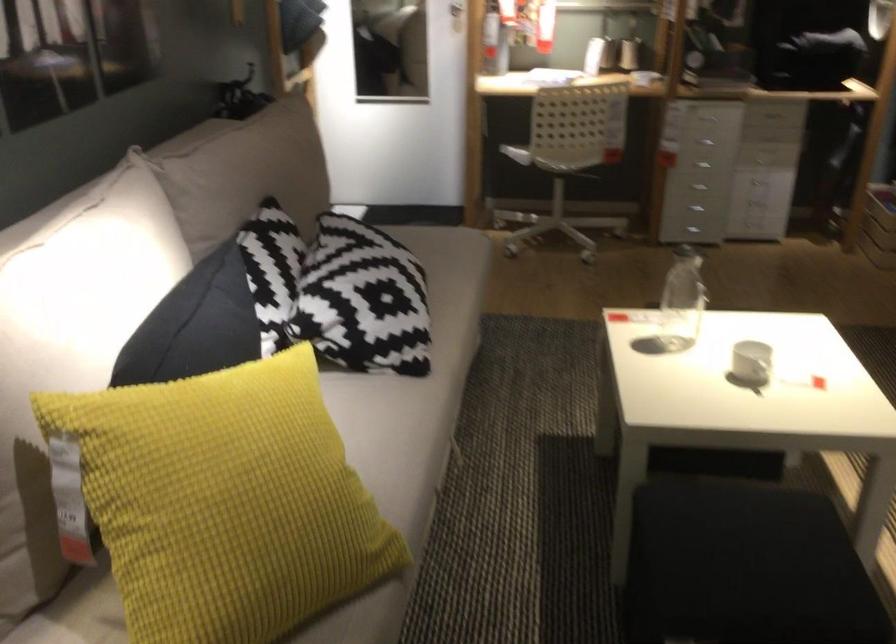
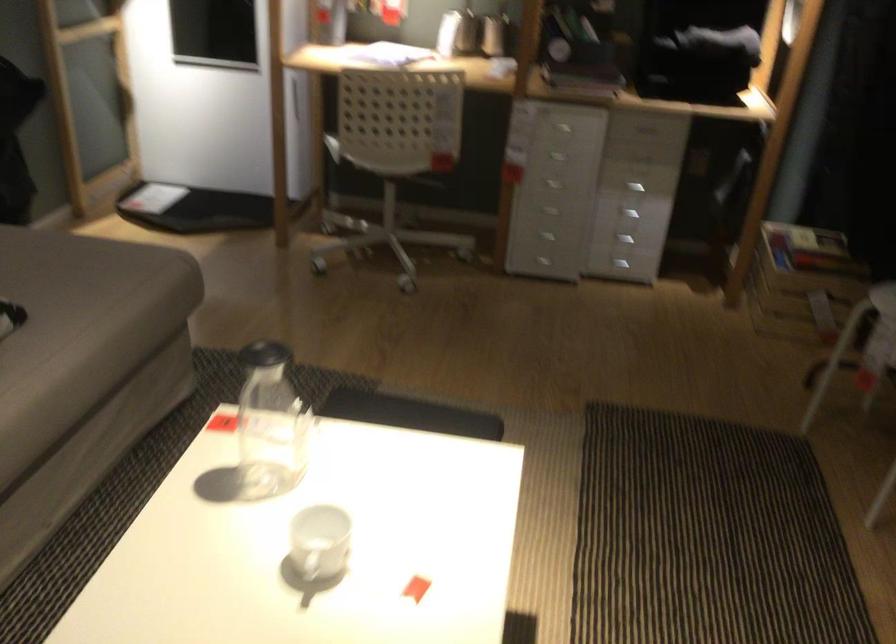
The images are taken continuously from a first-person perspective. In which direction are you moving?

The movement direction of the cameraman is right, forward.